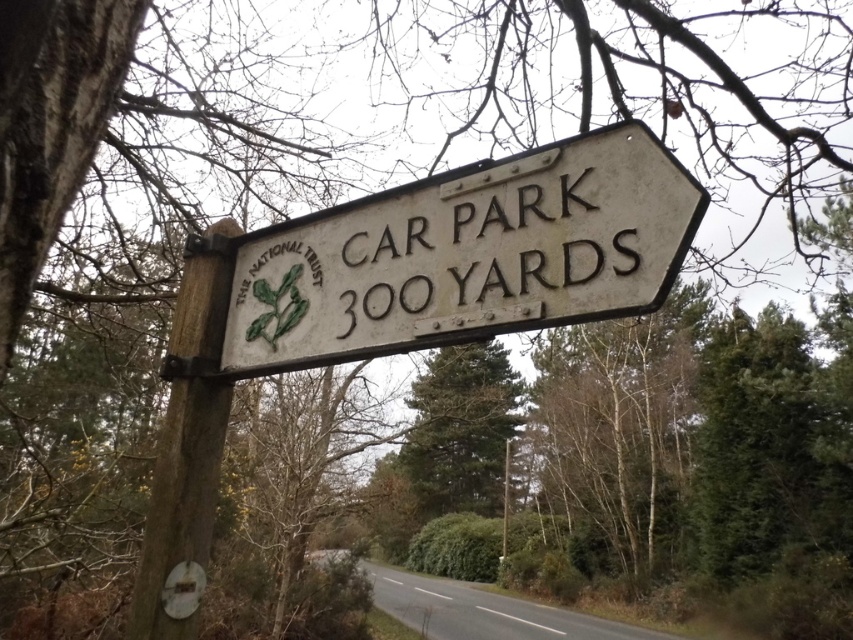
Can you confirm if white wooden sign at center is positioned to the left of brown wood pole at left?

In fact, white wooden sign at center is to the right of brown wood pole at left.

Can you confirm if white wooden sign at center is positioned below brown wood pole at left?

No.

Locate an element on the screen. white wooden sign at center is located at coordinates (466, 256).

Identify the location of white wooden sign at center. (466, 256).